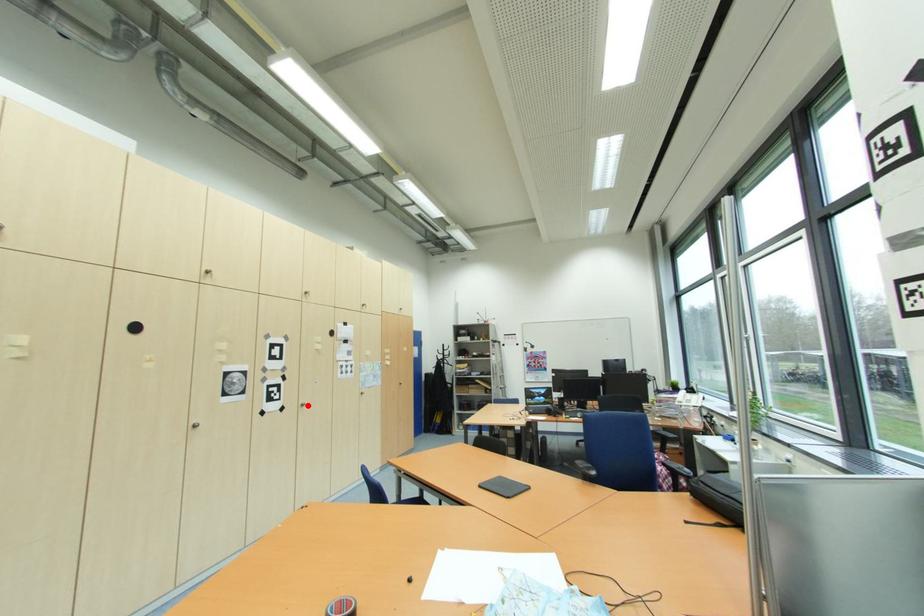
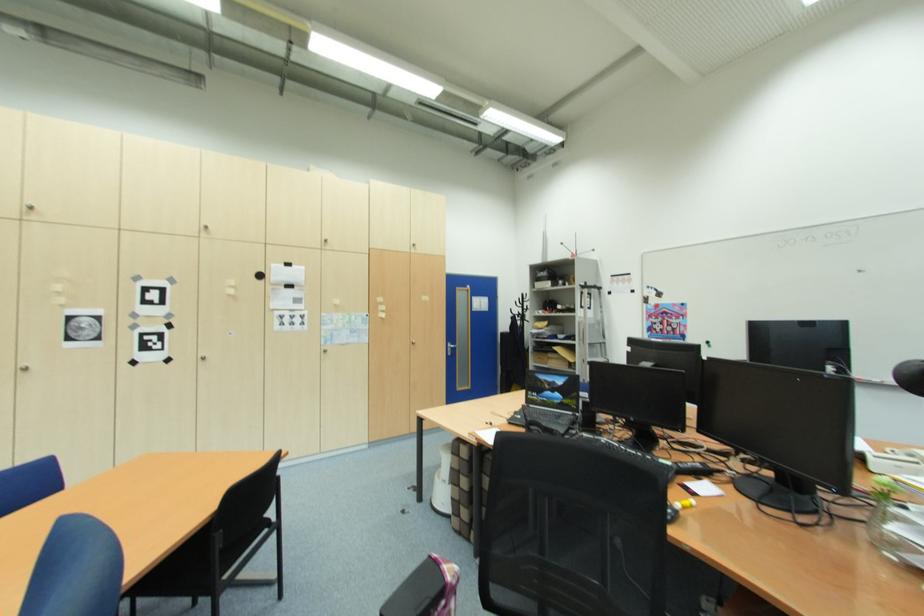
Question: I am providing you with two images of the same scene from different viewpoints. Image1 has a red point marked. In image2, the corresponding 3D location appears at what relative position? Reply with the corresponding letter.

Choices:
 (A) Closer
 (B) Farther

Answer: (A)